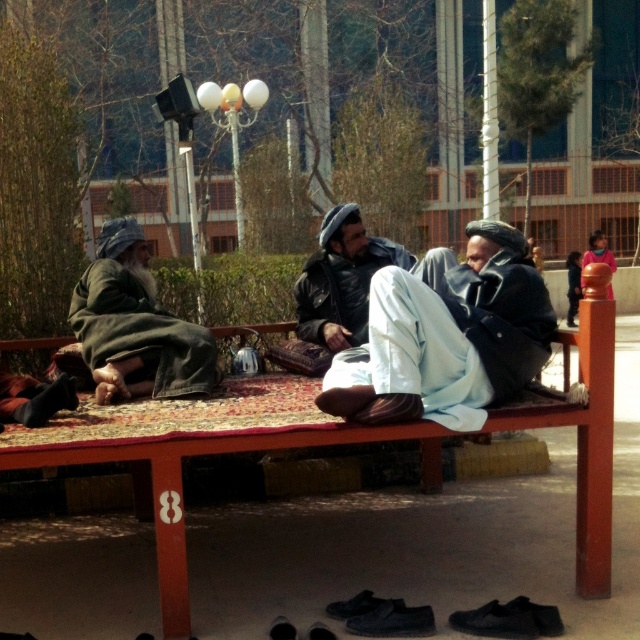
Question: Is the position of light blue fabric pants at center less distant than that of leather jacket at center?

Choices:
 (A) no
 (B) yes

Answer: (B)

Question: Which object is closer to the camera taking this photo?

Choices:
 (A) denim jacket at left
 (B) light blue fabric pants at center

Answer: (B)

Question: Does wooden picnic table at center appear over light blue fabric pants at center?

Choices:
 (A) no
 (B) yes

Answer: (A)

Question: Does light blue fabric pants at center appear over leather jacket at center?

Choices:
 (A) no
 (B) yes

Answer: (A)

Question: Which of these objects is positioned farthest from the denim jacket at left?

Choices:
 (A) leather jacket at center
 (B) wooden picnic table at center

Answer: (A)

Question: Which point is closer to the camera?

Choices:
 (A) (364, 296)
 (B) (116, 246)
 (C) (342, 380)

Answer: (C)